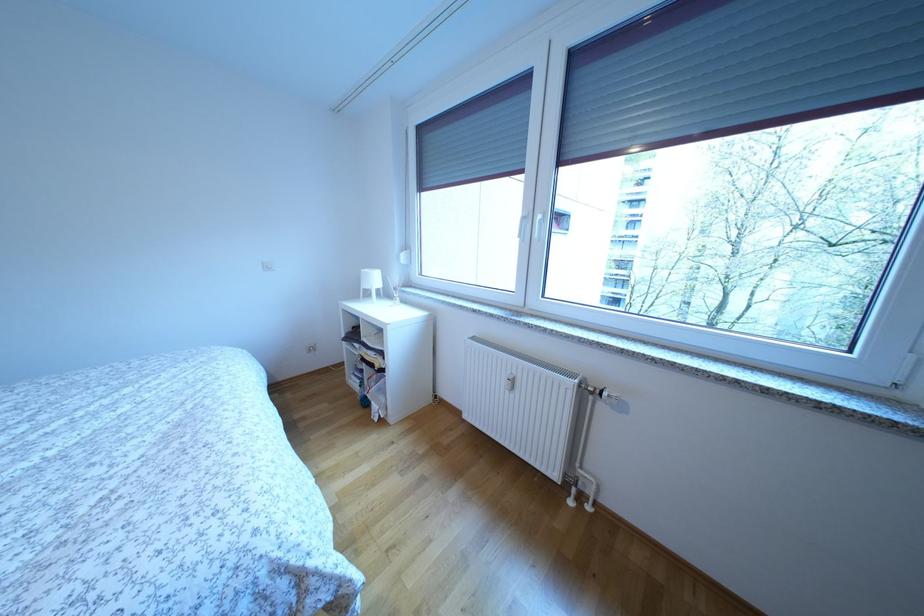
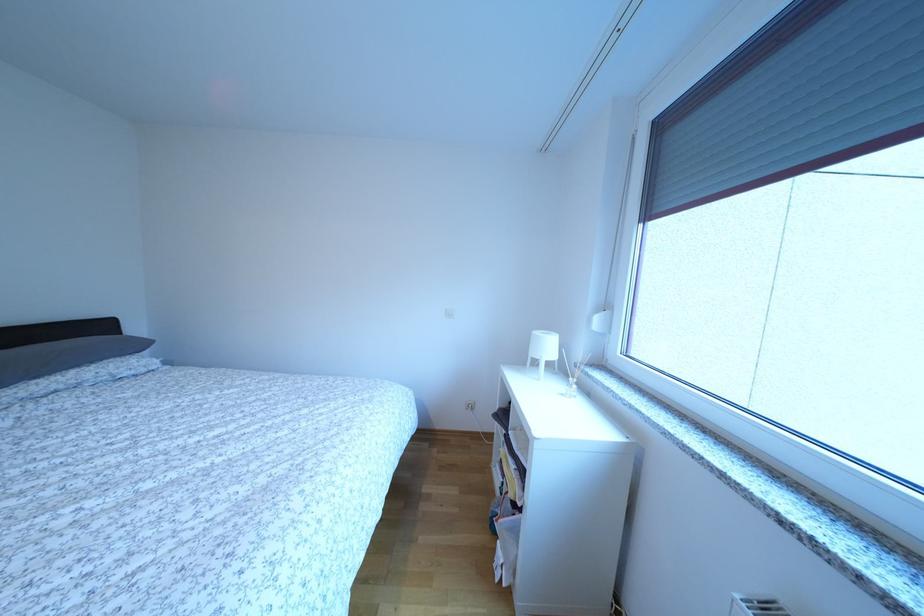
The point at [382,285] is marked in the first image. Where is the corresponding point in the second image?

(554, 353)